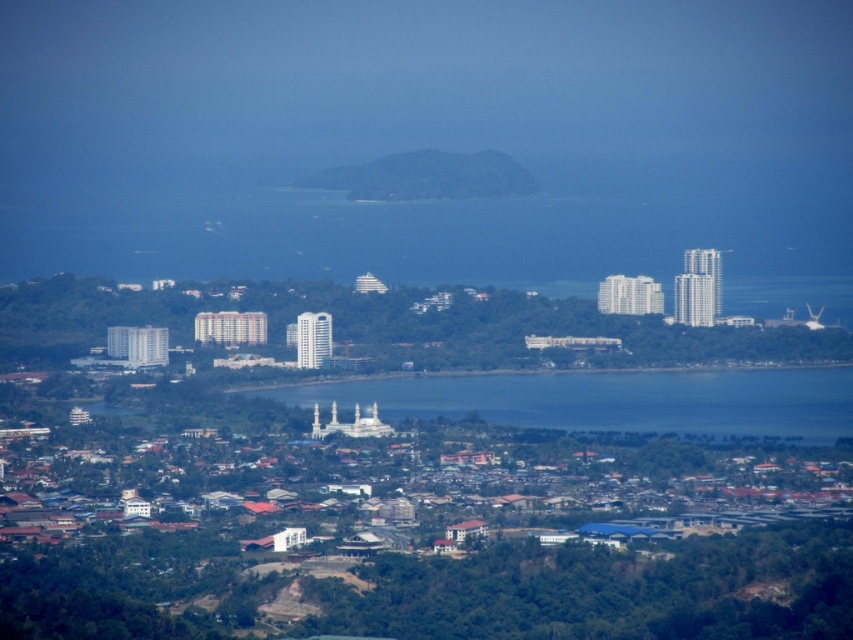
Looking at this image, is blue water at center below green textured hill at center?

Yes.

Between blue water at center and green textured hill at center, which one is positioned lower?

blue water at center

Describe the element at coordinates (608, 400) in the screenshot. The width and height of the screenshot is (853, 640). I see `blue water at center` at that location.

The height and width of the screenshot is (640, 853). Find the location of `blue water at center`. blue water at center is located at coordinates 608,400.